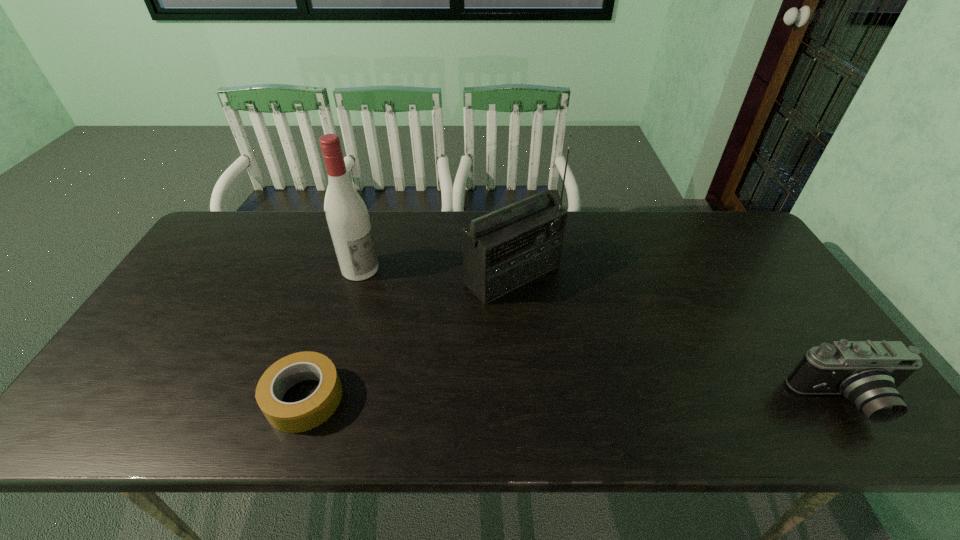
What are the coordinates of `free space located 0.370m on the label of the alcohol` in the screenshot? It's located at (474, 334).

Find the location of a particular element. Image resolution: width=960 pixels, height=540 pixels. free spot located on the front panel of the third object from left to right is located at coordinates (612, 359).

I want to click on vacant space located on the front panel of the third object from left to right, so click(621, 367).

At what (x,y) coordinates should I click in order to perform the action: click on vacant space situated 0.240m on the front panel of the third object from left to right. Please return your answer as a coordinate pair (x, y). Looking at the image, I should click on (609, 356).

Find the location of a particular element. The width and height of the screenshot is (960, 540). object at the far edge is located at coordinates (507, 248).

The width and height of the screenshot is (960, 540). I want to click on duct tape at the near edge, so (304, 415).

Find the location of a particular element. The image size is (960, 540). camera that is at the near edge is located at coordinates (867, 373).

I want to click on object located at the right edge, so click(x=867, y=373).

The image size is (960, 540). I want to click on object at the near right corner, so click(x=867, y=373).

In the image, there is a desktop. Find the location of `vacant space at the far edge`. vacant space at the far edge is located at coordinates (612, 226).